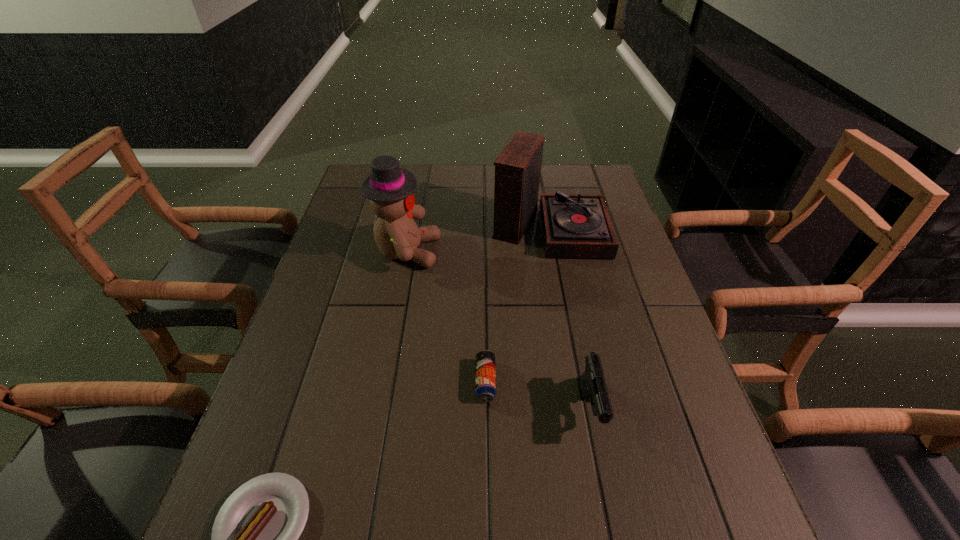
Locate an element on the screen. The image size is (960, 540). rag_doll is located at coordinates (389, 188).

Locate an element on the screen. phonograph record is located at coordinates (574, 225).

I want to click on the third shortest object, so click(x=592, y=382).

Locate an element on the screen. The image size is (960, 540). beer can is located at coordinates (485, 373).

I want to click on free space located on the front-facing side of the rag_doll, so click(481, 252).

The image size is (960, 540). I want to click on free spot located 0.060m on the left of the phonograph record, so click(472, 225).

Find the location of a particular element. This screenshot has height=540, width=960. free location located at the barrel of the pistol is located at coordinates (610, 498).

Identify the location of vacant space located 0.230m on the left of the third object from left to right. The image size is (960, 540). (370, 381).

This screenshot has height=540, width=960. In order to click on object present at the far edge in this screenshot , I will do `click(574, 225)`.

Identify the location of object that is at the left edge. Image resolution: width=960 pixels, height=540 pixels. (389, 188).